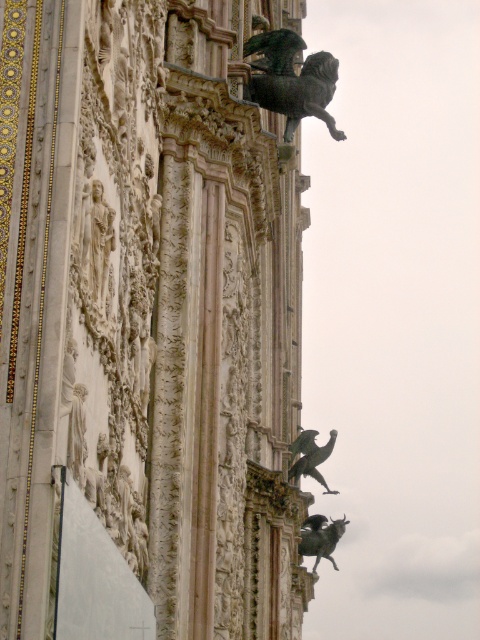
Is bronze/golden lion at upper center positioned behind shiny bronze gargoyle at upper right?

No, it is in front of shiny bronze gargoyle at upper right.

The height and width of the screenshot is (640, 480). What are the coordinates of `bronze/golden lion at upper center` in the screenshot? It's located at (291, 80).

Is shiny bronze gargoyle at upper right taller than shiny bronze bird at upper center?

Indeed, shiny bronze gargoyle at upper right has a greater height compared to shiny bronze bird at upper center.

Which is in front, point (312, 520) or point (321, 445)?

Point (321, 445) is more forward.

Does point (336, 531) lie in front of point (319, 458)?

No, it is not.

Locate an element on the screen. This screenshot has width=480, height=640. shiny bronze gargoyle at upper right is located at coordinates (321, 538).

Does bronze/golden lion at upper center have a lesser height compared to shiny bronze bird at upper center?

No.

Who is positioned more to the left, bronze/golden lion at upper center or shiny bronze bird at upper center?

bronze/golden lion at upper center is more to the left.

This screenshot has height=640, width=480. In order to click on bronze/golden lion at upper center in this screenshot , I will do `click(291, 80)`.